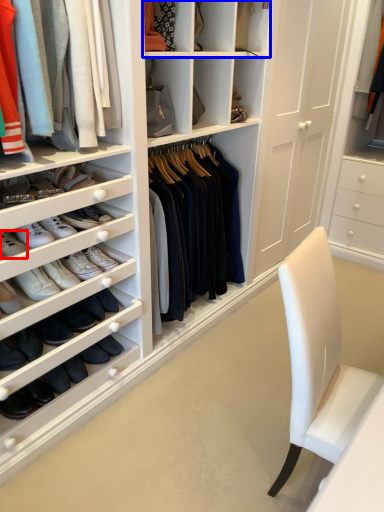
Question: Among these objects, which one is farthest to the camera, footwear (highlighted by a red box) or shelf (highlighted by a blue box)?

Choices:
 (A) footwear
 (B) shelf

Answer: (B)